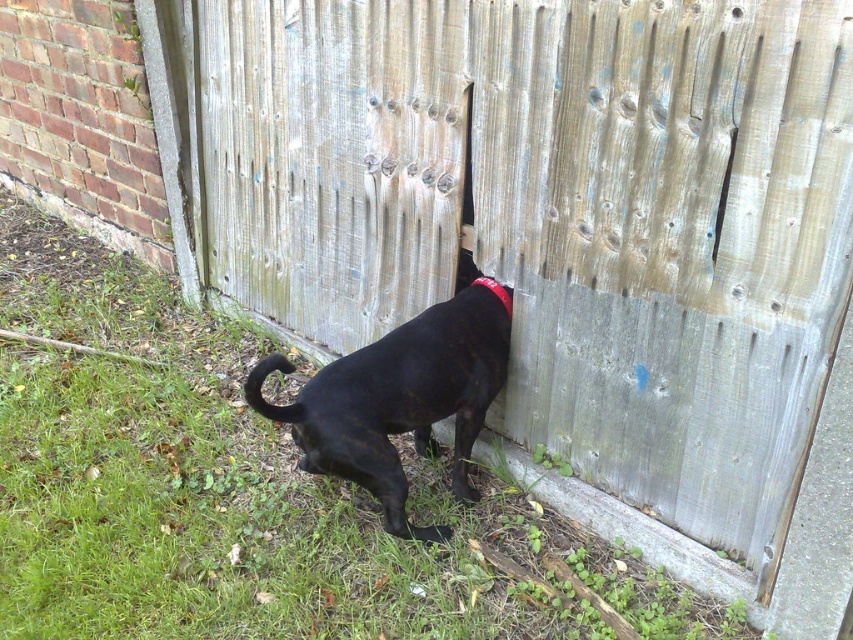
What do you see at coordinates (398, 401) in the screenshot? I see `black matte dog at center` at bounding box center [398, 401].

Which of these two, black matte dog at center or red fabric neckband at center, stands shorter?

red fabric neckband at center is shorter.

Where is `black matte dog at center`? black matte dog at center is located at coordinates (398, 401).